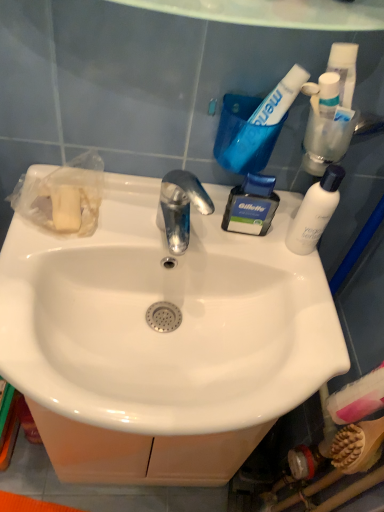
Question: Is the position of white glossy sink at center more distant than that of wooden bristles brush at lower right?

Choices:
 (A) yes
 (B) no

Answer: (B)

Question: Is white glossy sink at center next to wooden bristles brush at lower right?

Choices:
 (A) no
 (B) yes

Answer: (A)

Question: Is wooden bristles brush at lower right at the back of white glossy sink at center?

Choices:
 (A) no
 (B) yes

Answer: (A)

Question: Can you confirm if white glossy sink at center is smaller than wooden bristles brush at lower right?

Choices:
 (A) yes
 (B) no

Answer: (B)

Question: Does white glossy sink at center have a lesser height compared to wooden bristles brush at lower right?

Choices:
 (A) yes
 (B) no

Answer: (A)

Question: Considering the relative positions of white glossy sink at center and wooden bristles brush at lower right in the image provided, is white glossy sink at center to the right of wooden bristles brush at lower right from the viewer's perspective?

Choices:
 (A) no
 (B) yes

Answer: (A)

Question: Is blue plastic shaving cream at upper right, arranged as the 2th toiletry when ordered from the bottom, shorter than white matte bottle at upper right?

Choices:
 (A) no
 (B) yes

Answer: (B)

Question: Is blue plastic shaving cream at upper right, marked as the second toiletry in a top-to-bottom arrangement, completely or partially outside of white matte bottle at upper right?

Choices:
 (A) no
 (B) yes

Answer: (B)

Question: Is blue plastic shaving cream at upper right, arranged as the 2th toiletry when ordered from the bottom, in contact with white matte bottle at upper right?

Choices:
 (A) no
 (B) yes

Answer: (B)

Question: Can white matte bottle at upper right be found inside blue plastic shaving cream at upper right, the first toiletry from the left?

Choices:
 (A) yes
 (B) no

Answer: (B)

Question: From the image's perspective, is blue plastic shaving cream at upper right, marked as the second toiletry in a top-to-bottom arrangement, on top of white matte bottle at upper right?

Choices:
 (A) yes
 (B) no

Answer: (A)

Question: From a real-world perspective, is blue plastic shaving cream at upper right, arranged as the 2th toiletry when ordered from the bottom, under white matte bottle at upper right?

Choices:
 (A) no
 (B) yes

Answer: (B)

Question: From a real-world perspective, is white matte bottle at upper right on top of clear plastic tube at upper right, the second toiletry in the left-to-right sequence?

Choices:
 (A) yes
 (B) no

Answer: (B)